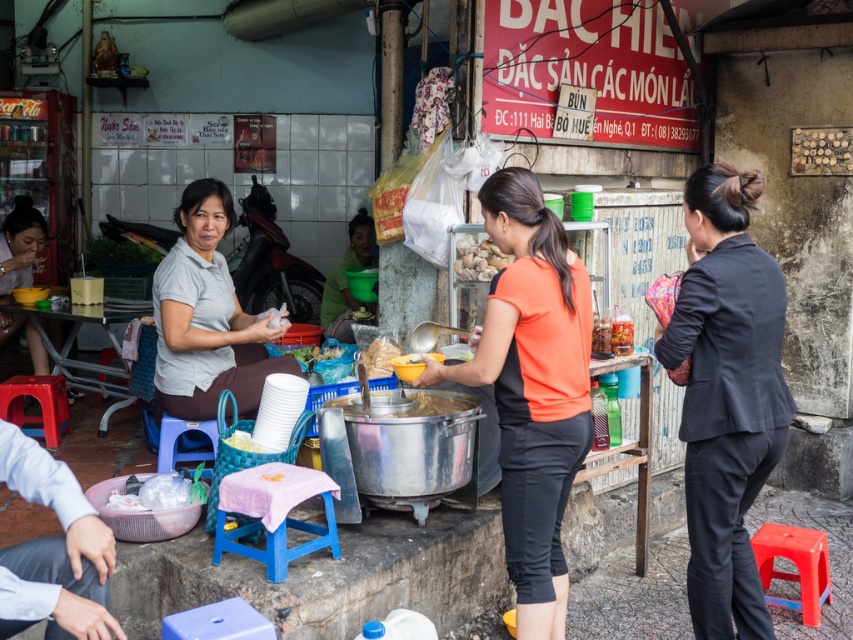
Question: Where is black fabric suit at right located in relation to blue plastic stool at lower center in the image?

Choices:
 (A) below
 (B) above

Answer: (B)

Question: Which object is the closest to the matte gray shirt at lower left?

Choices:
 (A) blue plastic stool at lower center
 (B) red plastic stool at lower right
 (C) blue plastic stool at lower left
 (D) black fabric suit at right

Answer: (C)

Question: Which object is closer to the camera taking this photo?

Choices:
 (A) orange fabric shirt at center
 (B) blue plastic stool at lower center

Answer: (A)

Question: Is orange fabric shirt at center smaller than green matte bowl at center?

Choices:
 (A) no
 (B) yes

Answer: (B)

Question: Among these objects, which one is nearest to the camera?

Choices:
 (A) red plastic stool at lower left
 (B) black fabric suit at right
 (C) red plastic stool at lower right

Answer: (B)

Question: Is blue plastic stool at lower center positioned at the back of yellow matte bowl at center?

Choices:
 (A) no
 (B) yes

Answer: (A)